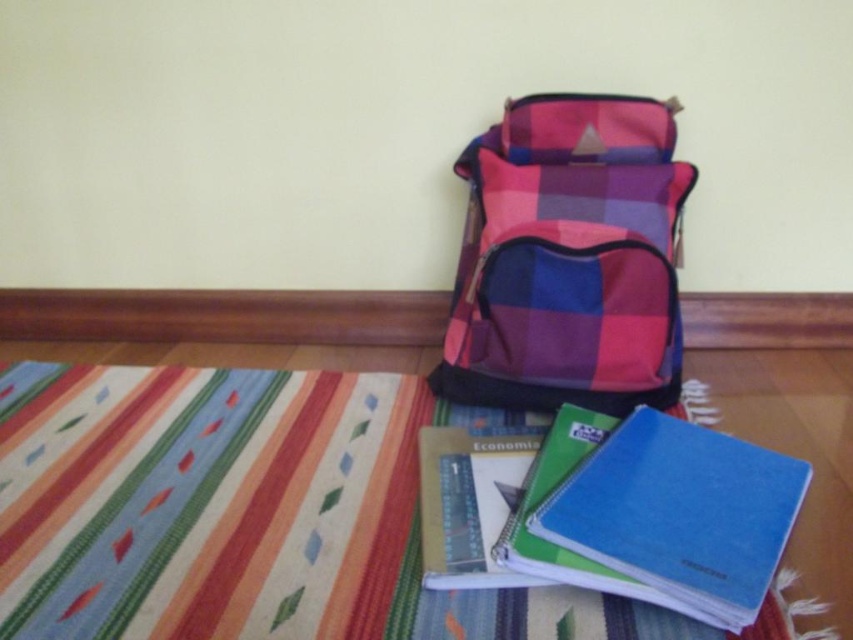
Question: Does striped fabric mat at lower center lie behind blue matte notebook at lower right?

Choices:
 (A) yes
 (B) no

Answer: (A)

Question: Which object is the farthest from the blue matte notebook at lower right?

Choices:
 (A) striped fabric mat at lower center
 (B) plaid fabric backpack at center

Answer: (A)

Question: Can you confirm if striped fabric mat at lower center is smaller than blue matte notebook at lower right?

Choices:
 (A) no
 (B) yes

Answer: (A)

Question: Can you confirm if striped fabric mat at lower center is smaller than plaid fabric backpack at center?

Choices:
 (A) yes
 (B) no

Answer: (B)

Question: Considering the real-world distances, which object is closest to the plaid fabric backpack at center?

Choices:
 (A) blue matte notebook at lower right
 (B) striped fabric mat at lower center

Answer: (A)

Question: Among these objects, which one is farthest from the camera?

Choices:
 (A) striped fabric mat at lower center
 (B) plaid fabric backpack at center
 (C) blue matte notebook at lower right

Answer: (B)